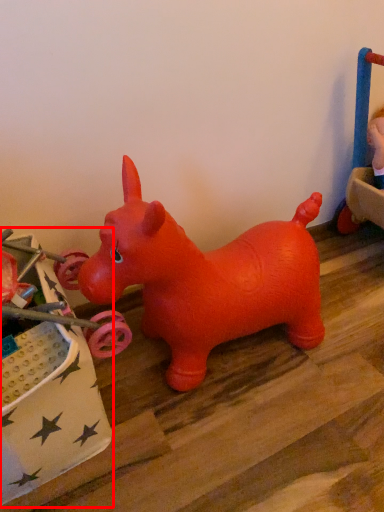
Question: From the image's perspective, what is the correct spatial relationship of toy (annotated by the red box) in relation to toy?

Choices:
 (A) below
 (B) above

Answer: (A)